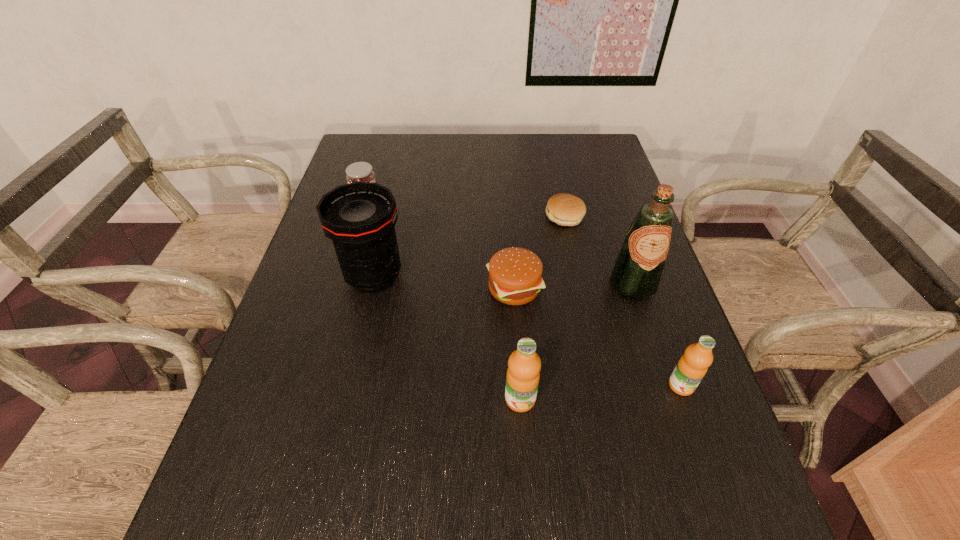
Where is `vacant space that is in between the right orange juice and the tallest object`? The width and height of the screenshot is (960, 540). vacant space that is in between the right orange juice and the tallest object is located at coordinates (657, 335).

The image size is (960, 540). What are the coordinates of `vacant space in between the third shortest object and the hamburger` in the screenshot? It's located at (440, 245).

Locate an element on the screen. Image resolution: width=960 pixels, height=540 pixels. vacant area between the patty and the telephoto lens is located at coordinates (469, 247).

What are the coordinates of `vacant area that lies between the third shortest object and the shortest object` in the screenshot? It's located at (466, 208).

What are the coordinates of `free space between the fifth shortest object and the fourth tallest object` in the screenshot? It's located at (601, 392).

Find the location of a particular element. The image size is (960, 540). object that is the fourth closest to the third shortest object is located at coordinates (636, 274).

Image resolution: width=960 pixels, height=540 pixels. I want to click on the fifth closest object to the jam, so click(523, 374).